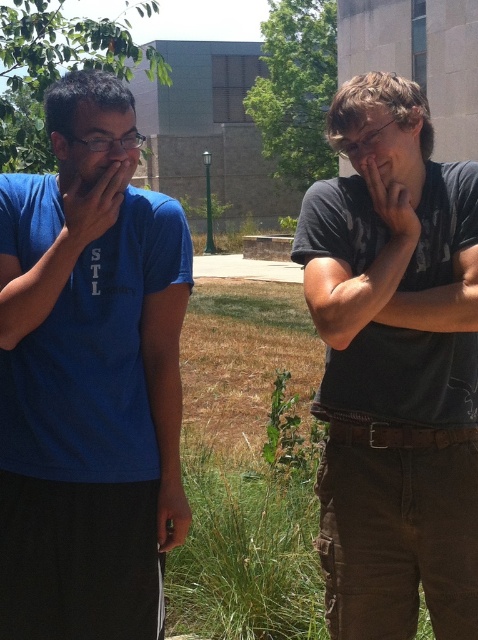
Question: Which of these objects is positioned farthest from the blue matte t-shirt at left?

Choices:
 (A) matte black hand at center
 (B) dark gray t-shirt at center
 (C) matte skin hand at left

Answer: (A)

Question: Which object is closer to the camera taking this photo?

Choices:
 (A) dark gray t-shirt at center
 (B) blue matte t-shirt at left
 (C) matte black hand at center
 (D) matte skin hand at left

Answer: (B)

Question: Which point is farther from the camera taking this photo?

Choices:
 (A) (84, 554)
 (B) (97, 182)

Answer: (A)

Question: Considering the relative positions of matte skin hand at left and matte black hand at center in the image provided, where is matte skin hand at left located with respect to matte black hand at center?

Choices:
 (A) left
 (B) right

Answer: (A)

Question: Is blue matte t-shirt at left to the left of matte skin hand at left from the viewer's perspective?

Choices:
 (A) no
 (B) yes

Answer: (A)

Question: Does matte skin hand at left appear over matte black hand at center?

Choices:
 (A) no
 (B) yes

Answer: (B)